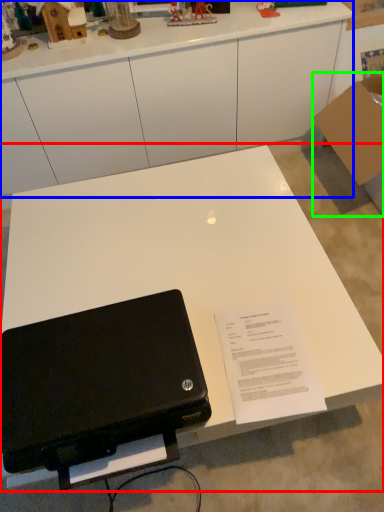
Question: Based on their relative distances, which object is nearer to table (highlighted by a red box)? Choose from desk (highlighted by a blue box) and cardboard box (highlighted by a green box).

Choices:
 (A) desk
 (B) cardboard box

Answer: (A)